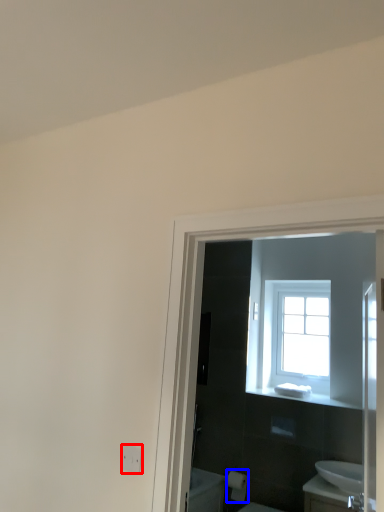
Question: Which object is closer to the camera taking this photo, electric outlet (highlighted by a red box) or toilet paper (highlighted by a blue box)?

Choices:
 (A) electric outlet
 (B) toilet paper

Answer: (A)